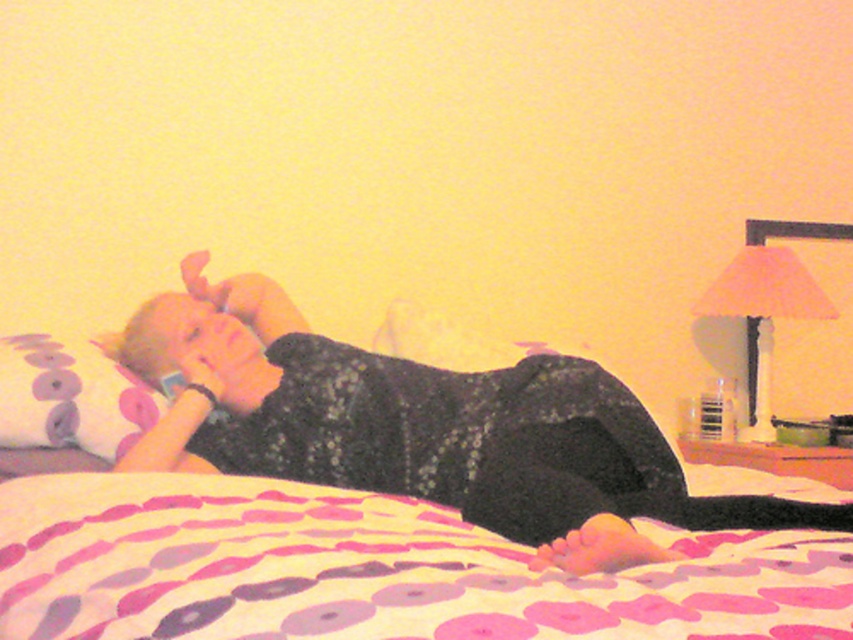
Question: From the image, what is the correct spatial relationship of patterned fabric blanket at center in relation to floral fabric pillow at left?

Choices:
 (A) left
 (B) right

Answer: (B)

Question: Among these points, which one is farthest from the camera?

Choices:
 (A) (457, 596)
 (B) (97, 454)
 (C) (468, 483)

Answer: (B)

Question: In this image, where is patterned fabric blanket at center located relative to floral fabric pillow at left?

Choices:
 (A) above
 (B) below

Answer: (B)

Question: Which of these objects is positioned closest to the floral fabric pillow at left?

Choices:
 (A) patterned fabric blanket at center
 (B) matte black dress at center

Answer: (B)

Question: Does patterned fabric blanket at center lie behind matte black dress at center?

Choices:
 (A) no
 (B) yes

Answer: (A)

Question: Which object is closer to the camera taking this photo?

Choices:
 (A) patterned fabric blanket at center
 (B) matte black dress at center

Answer: (A)